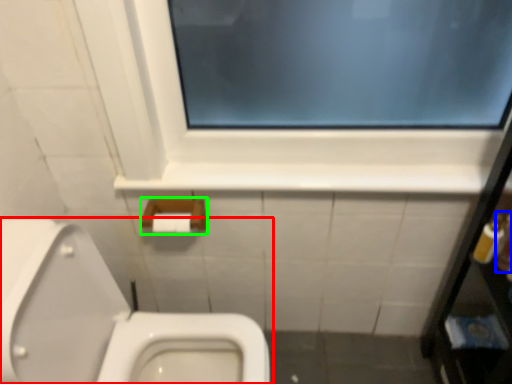
Question: Considering the real-world distances, which object is closest to toilet (highlighted by a red box)? toiletry (highlighted by a blue box) or towel bar (highlighted by a green box).

Choices:
 (A) toiletry
 (B) towel bar

Answer: (B)